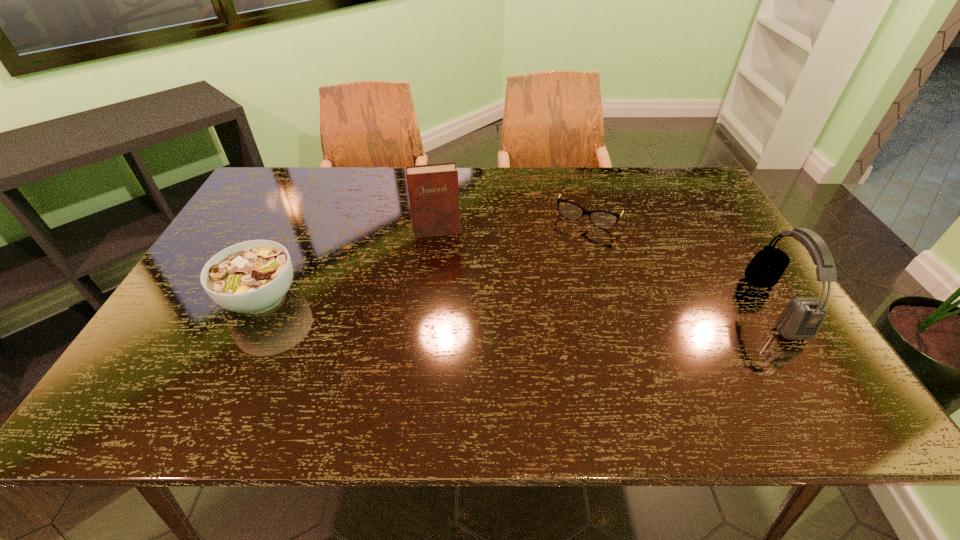
The width and height of the screenshot is (960, 540). Find the location of `vacant space on the desktop that is between the second shortest object and the rightmost object and is positioned on the front cover of the second object from left to right`. vacant space on the desktop that is between the second shortest object and the rightmost object and is positioned on the front cover of the second object from left to right is located at coordinates (447, 301).

Where is `vacant space on the desktop that is between the leftmost object and the headset and is positioned on the front-facing side of the spectacles`? vacant space on the desktop that is between the leftmost object and the headset and is positioned on the front-facing side of the spectacles is located at coordinates (542, 302).